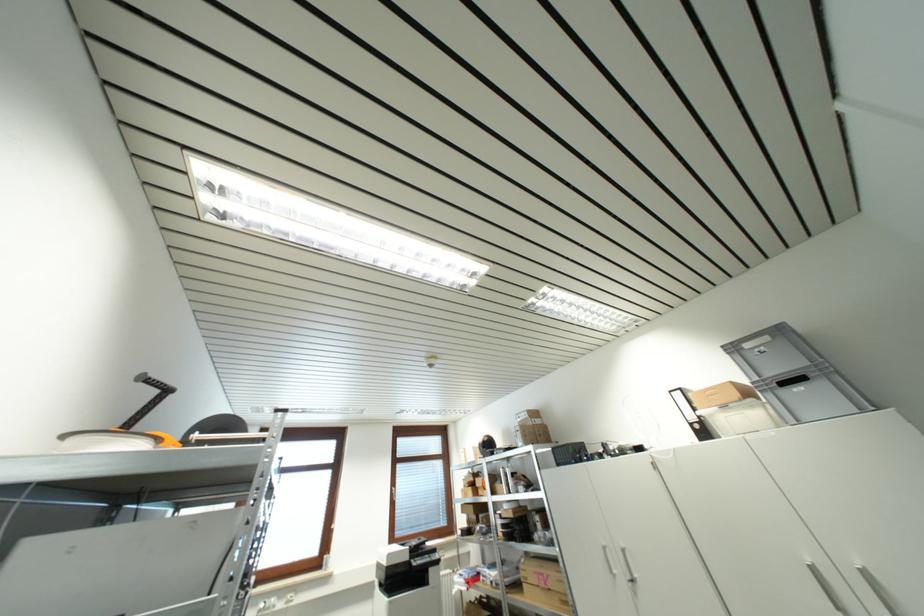
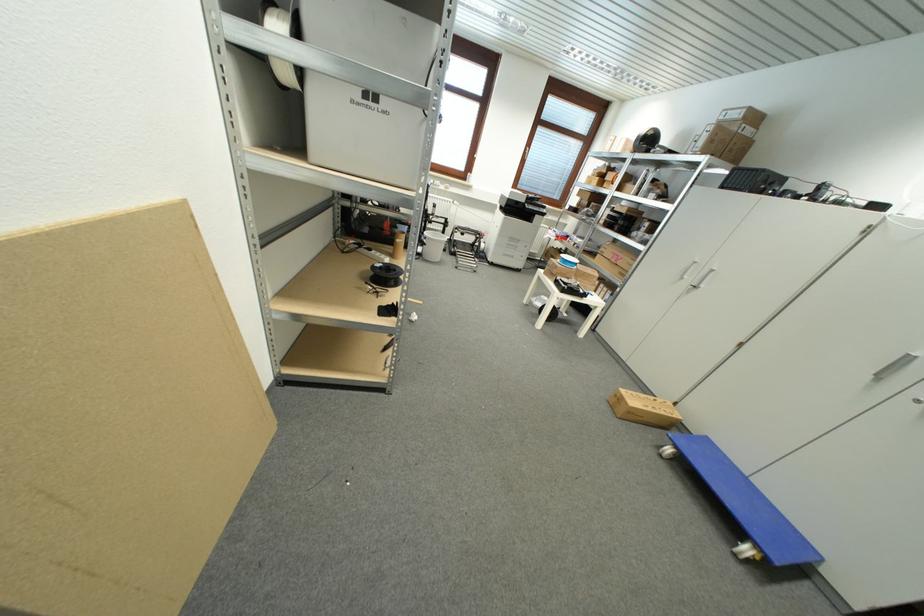
Find the pixel in the second image that matches (x=573, y=447) in the first image.

(769, 174)